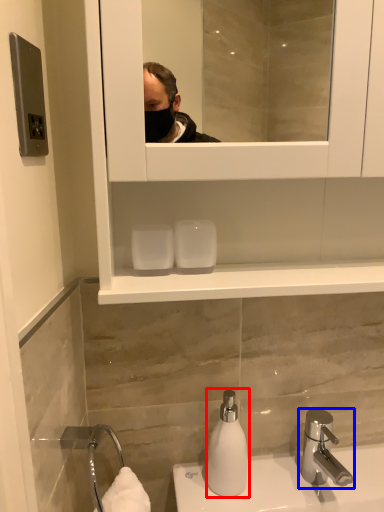
Question: Among these objects, which one is farthest to the camera, soap dispenser (highlighted by a red box) or tap (highlighted by a blue box)?

Choices:
 (A) soap dispenser
 (B) tap

Answer: (A)